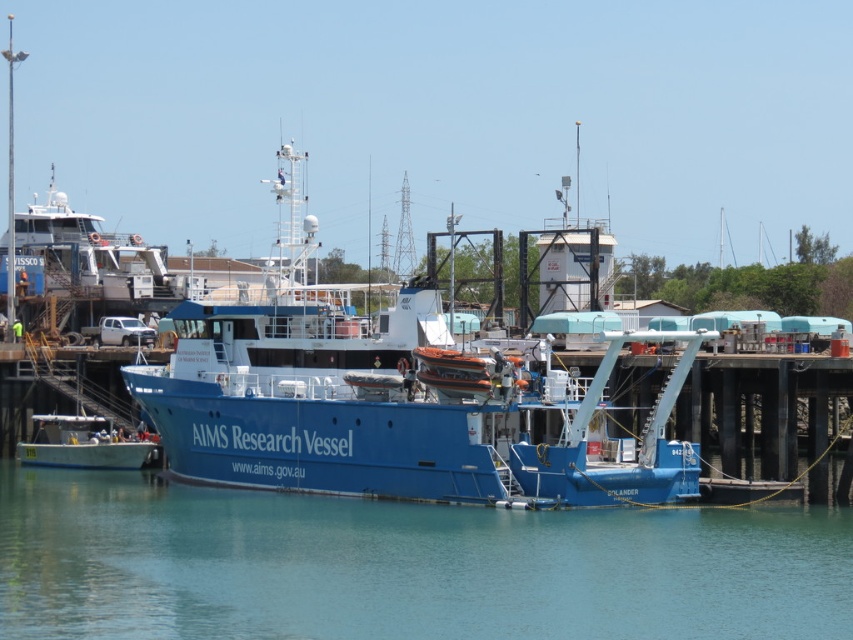
You are a marine biologist preparing to board the blue matte research vessel at center and the blue matte boat at lower left. Which vessel do you think has a higher deck height for conducting aerial observations?

The blue matte research vessel at center is taller than the blue matte boat at lower left, so its deck height is higher, making it better for aerial observations.

You are a marine biologist preparing to board the blue matte research vessel at center from the pier. As you walk towards the vessel, you notice the clear blue water at center. Which object will you encounter first?

The clear blue water at center is in front of the blue matte research vessel at center, so you will encounter the clear blue water at center first before reaching the vessel.

You are standing on the wooden pier at the marina and looking towards the large blue research vessel. There is a point marked at coordinates (402, 564). What is located at this point?

At point (402, 564) lies clear blue water at center.